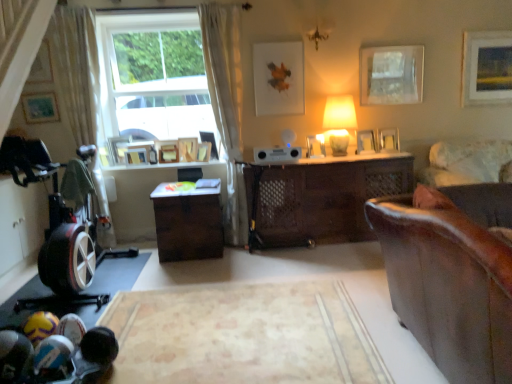
Image resolution: width=512 pixels, height=384 pixels. In order to click on vacant area in front of wooden picture frame at center, placed as the third picture frame when sorted from right to left in this screenshot , I will do `click(390, 153)`.